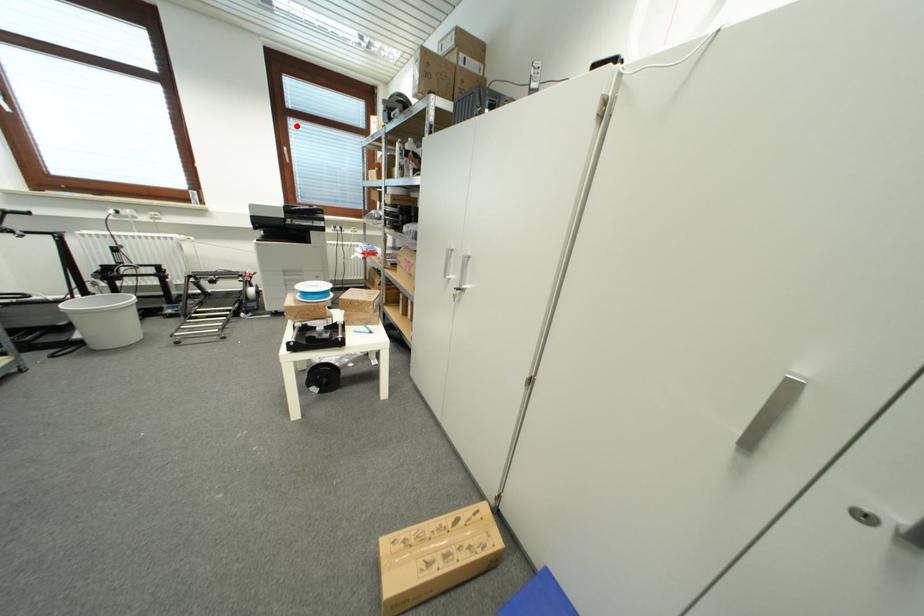
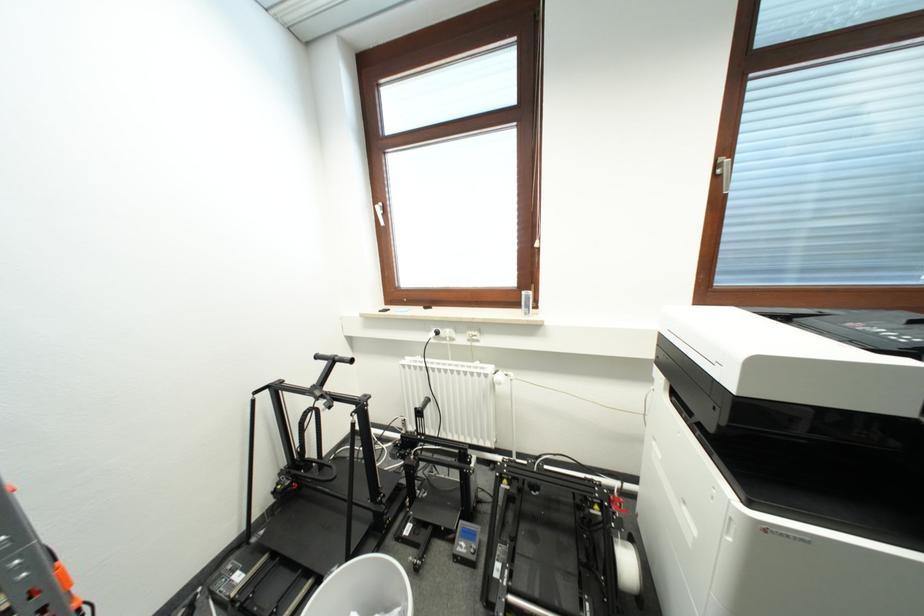
Find the pixel in the second image that matches the highlighted location in the first image.

(766, 89)